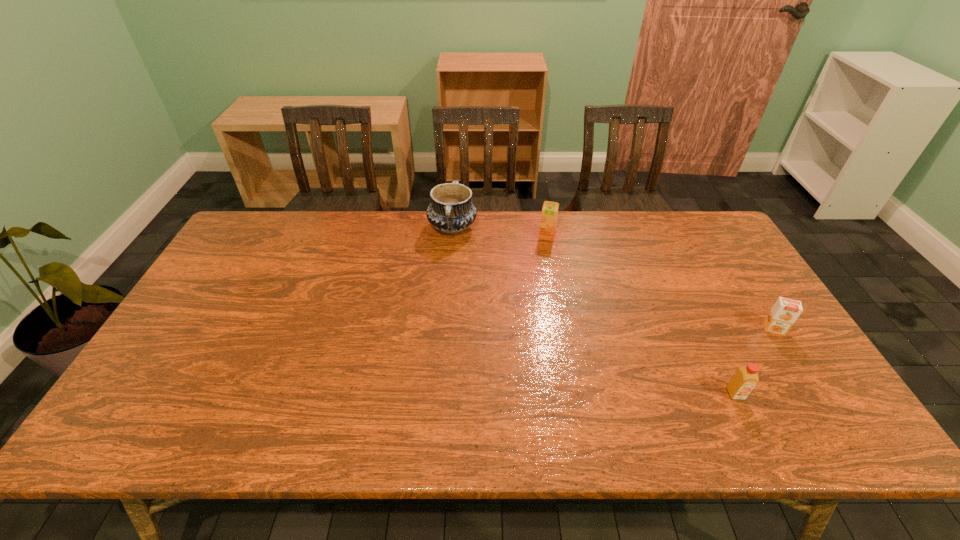
The width and height of the screenshot is (960, 540). I want to click on empty location between the second orange juice from right to left and the leftmost orange juice, so click(641, 315).

This screenshot has height=540, width=960. In order to click on object that is the second closest one to the third object from right to left in this screenshot , I will do `click(784, 313)`.

Identify which object is the nearest to the nearest orange juice. Please provide its 2D coordinates. Your answer should be formatted as a tuple, i.e. [(x, y)], where the tuple contains the x and y coordinates of a point satisfying the conditions above.

[(784, 313)]

Where is `orange juice that is the closest to the leftmost object`? This screenshot has width=960, height=540. orange juice that is the closest to the leftmost object is located at coordinates (549, 214).

Identify which orange juice is located as the third nearest to the pottery. Please provide its 2D coordinates. Your answer should be formatted as a tuple, i.e. [(x, y)], where the tuple contains the x and y coordinates of a point satisfying the conditions above.

[(784, 313)]